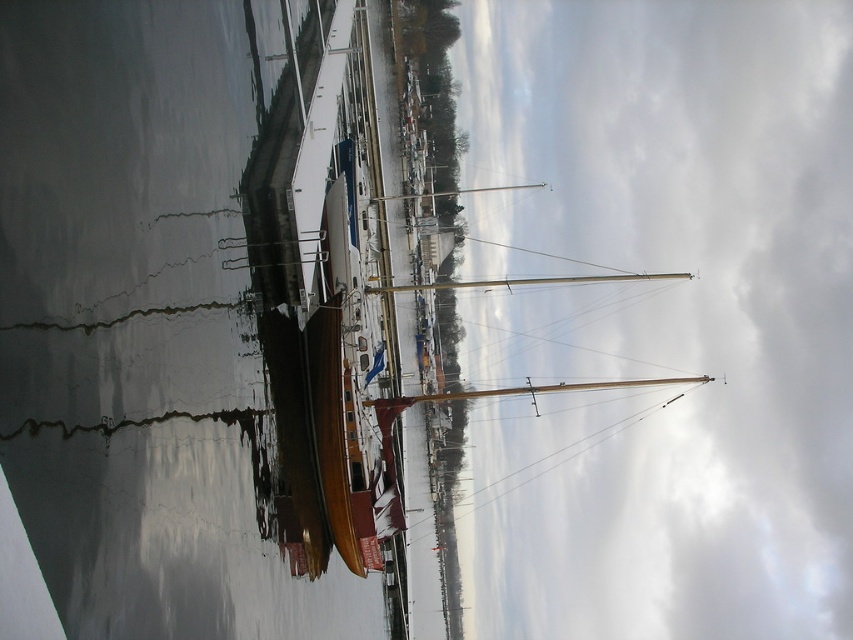
You are standing on the wooden boat and looking down at the water. Where is the glossy water at lower left located in relation to your position?

The glossy water at lower left is located at point (x=149, y=323) relative to your position on the wooden boat.

You are an artist planning to paint the marina scene. You need to decide which object should occupy more horizontal space in your painting. Based on the scene, which object between the white cloudy sky at upper center and the polished wood mast at center should you depict as wider?

The white cloudy sky at upper center is wider than the polished wood mast at center, so you should depict the white cloudy sky at upper center as wider in your painting.

You are a photographer planning to take a picture of the white cloudy sky at upper center and the polished wood mast at center. Based on the scene, which object will appear taller in the photo?

The white cloudy sky at upper center is much taller than the polished wood mast at center, so it will appear taller in the photo.